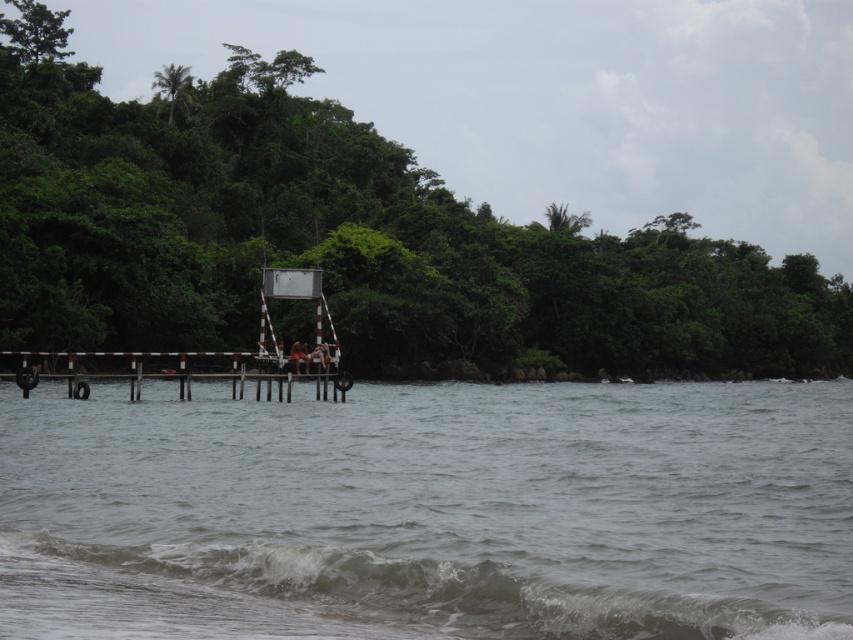
You are standing on the pier and see the gray frothy wave at lower center and the blonde hair person at center. Which one appears narrower in width?

The gray frothy wave at lower center is thinner than the blonde hair person at center, so the gray frothy wave at lower center appears narrower in width.

Based on the photo, you are standing at the origin point of the coordinate system in the image. You want to reach the gray water at lower left. According to the coordinates provided, in which direction should you move from your current position?

The gray water at lower left is located at coordinate point 0.802 on the x axis and 0.505 on the y axis. Since you are at the origin point, you should move towards the positive x direction and the positive y direction to reach it.

You are standing at the point with coordinates point (302,340) and want to walk to the point (27,390). According to the scene, will you be moving towards the shore or away from it?

Point (27,390) is in front of point (302,340), so moving from point (302,340) to point (27,390) means you are moving towards the shore.